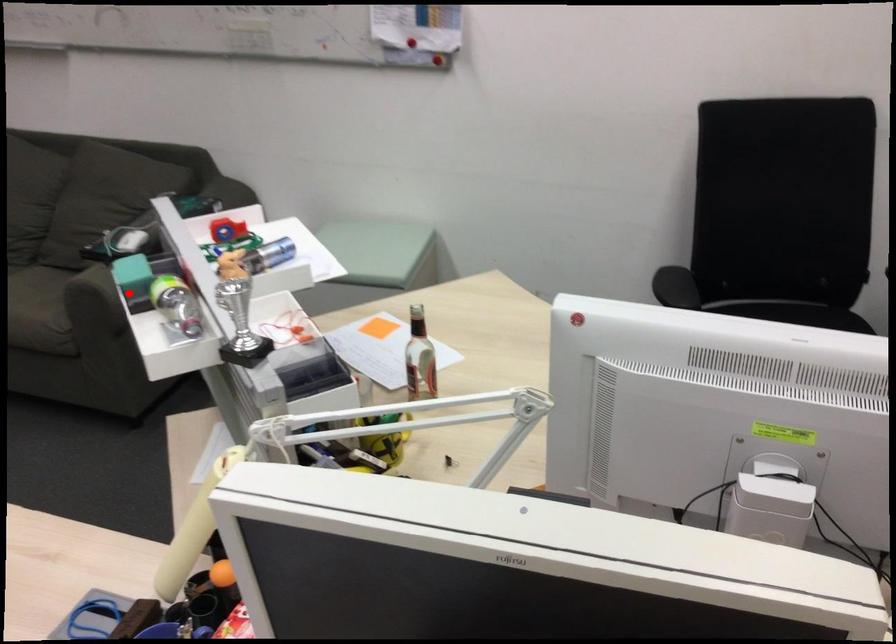
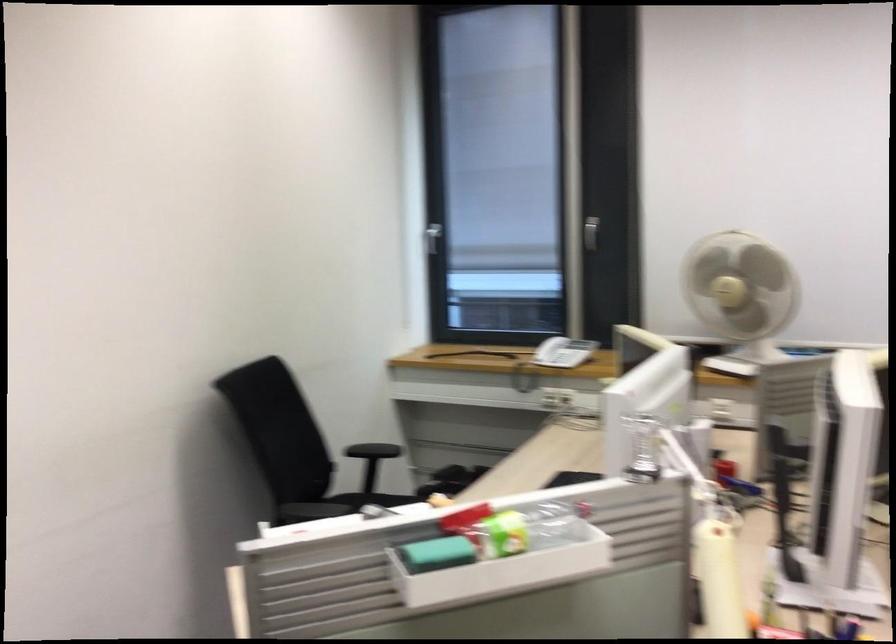
Question: A red point is marked in image1. In image2, is the corresponding 3D point closer to the camera or farther? Reply with the corresponding letter.

Choices:
 (A) The corresponding 3D point is closer.
 (B) The corresponding 3D point is farther.

Answer: (A)